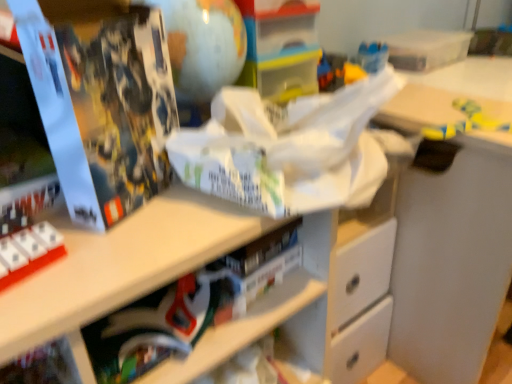
The height and width of the screenshot is (384, 512). Find the location of `empty space that is to the right of matte black book at left`. empty space that is to the right of matte black book at left is located at coordinates (189, 206).